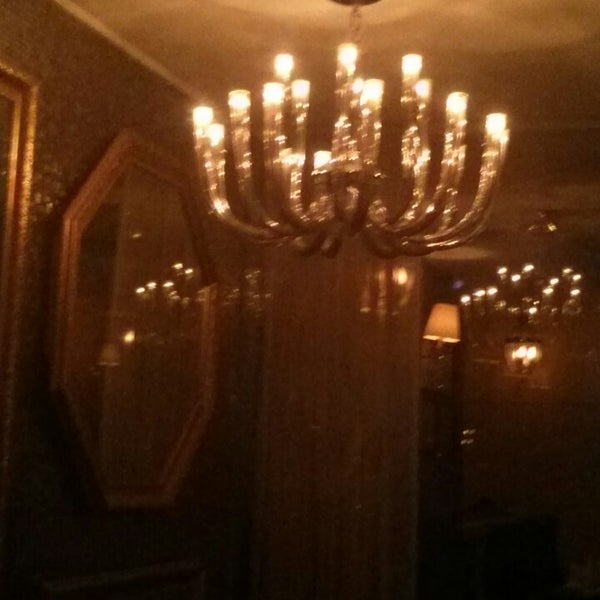
This screenshot has height=600, width=600. I want to click on reflection of lamp, so click(x=107, y=351).